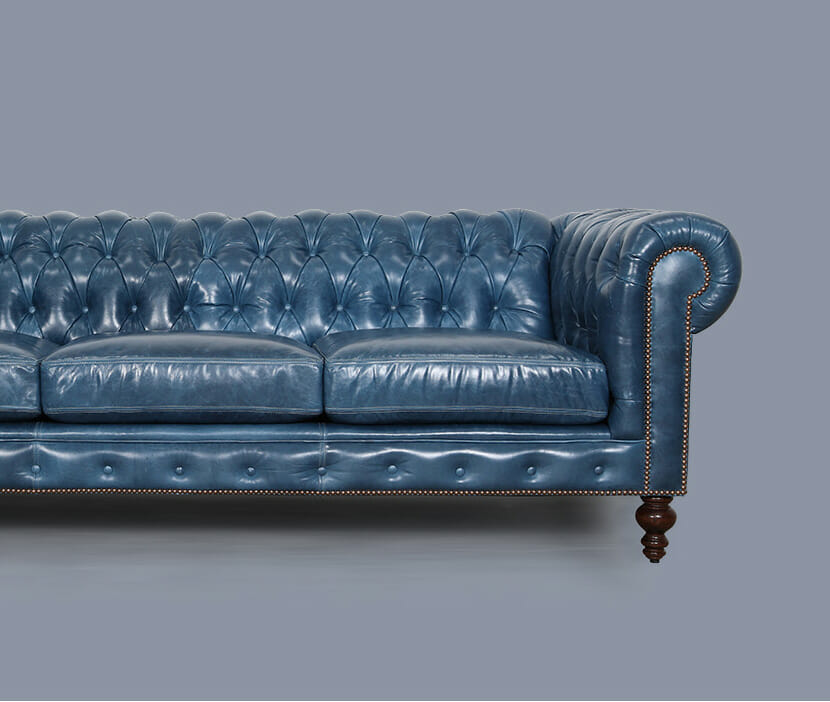
This screenshot has width=830, height=702. I want to click on shadow under couch, so click(455, 522).